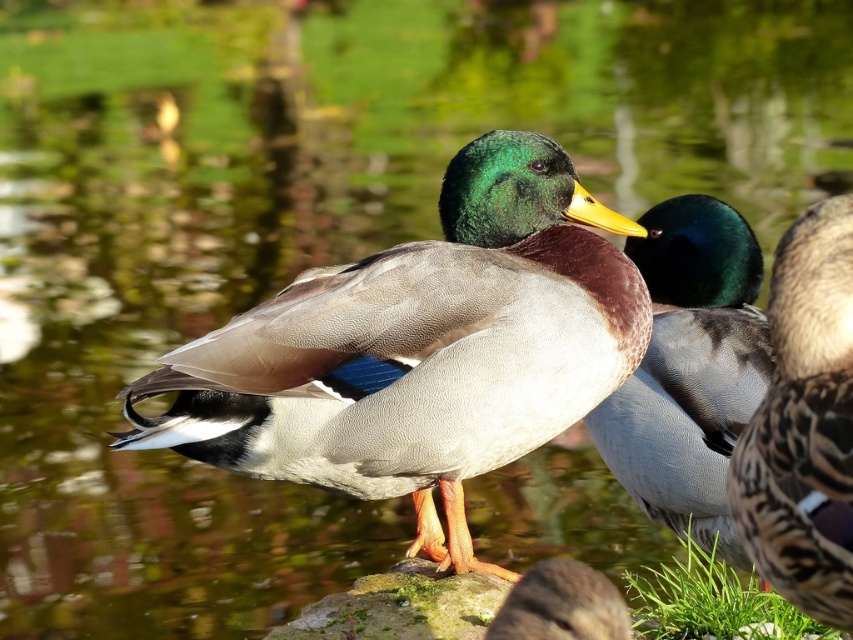
From the picture: You are a birdwatcher observing two ducks in a pond. You notice the brown speckled feathers at center and the green leafy grass at lower right. Which object is located to the right of the other?

The brown speckled feathers at center is positioned on the left side of green leafy grass at lower right, so the green leafy grass at lower right is to the right of the brown speckled feathers at center.

You are a wildlife photographer trying to capture both the green glossy duck at center and the brown speckled feathers at center in a single frame. Given that your camera can only focus on objects wider than 10 cm, can you include both ducks in the frame without needing to adjust your camera settings?

The green glossy duck at center is larger in width than the brown speckled feathers at center. Since the camera requires objects wider than 10 cm to focus, and the green glossy duck at center is wider, it should be within focus. However, the brown speckled feathers at center may be narrower than 10 cm, so it might not focus properly. Adjustments may be needed for both to be clear.